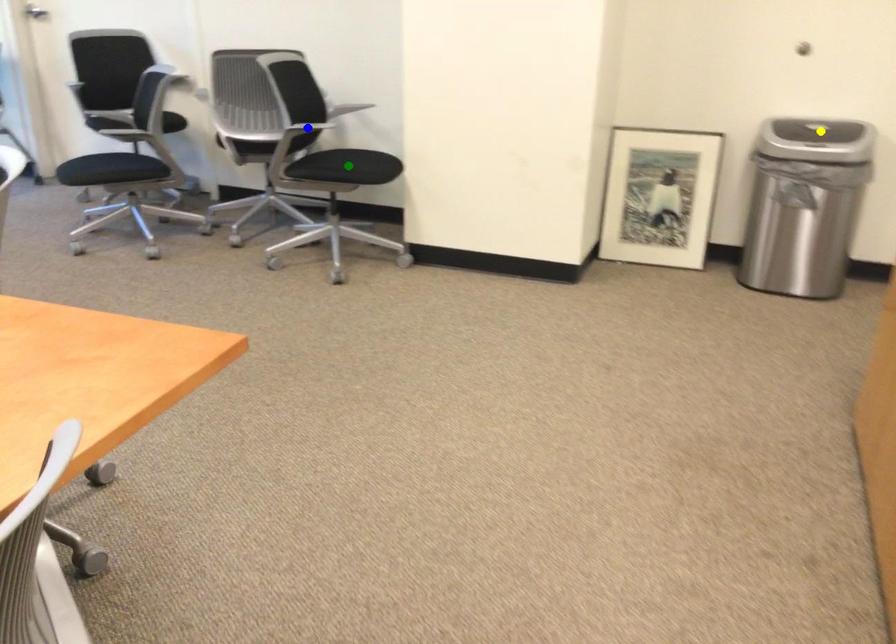
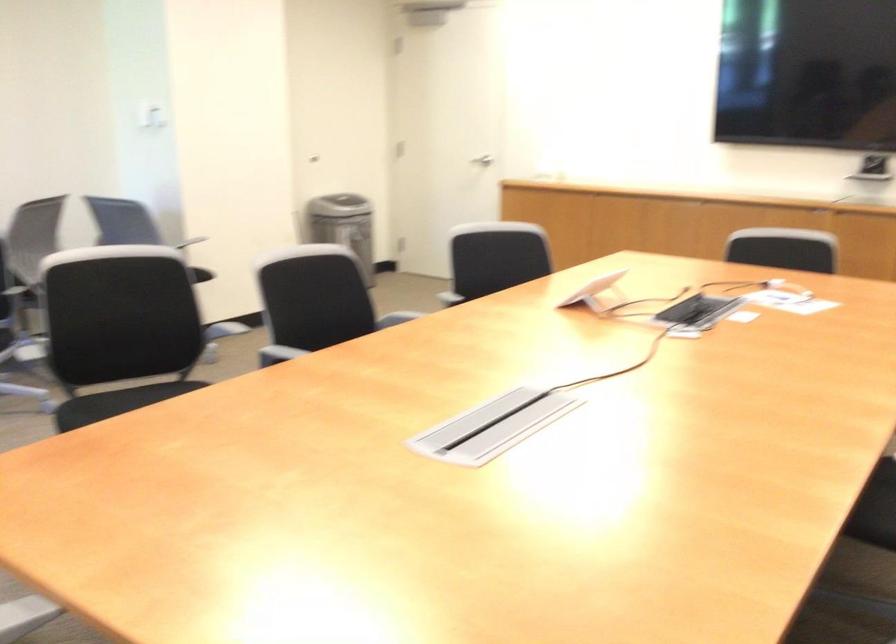
I am providing you with two images of the same scene from different viewpoints. Three points are marked in image1. Which point corresponds to a part or object that is occluded in image2?In image1, three points are marked. Which of them correspond to a part or object that is occluded in image2?Among the three points shown in image1, which one corresponds to a part or object that is no longer visible due to occlusion in image2?

yellow point, blue point, green point